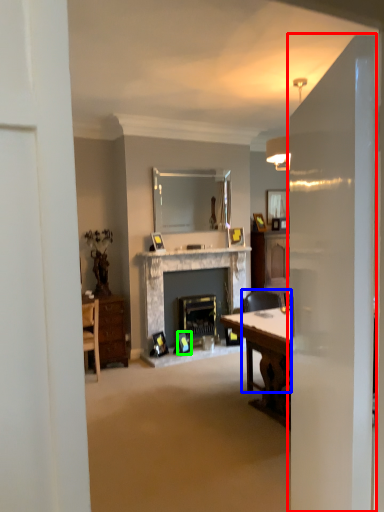
Question: Considering the real-world distances, which object is farthest from glass door (highlighted by a red box)? chair (highlighted by a blue box) or picture frame (highlighted by a green box)?

Choices:
 (A) chair
 (B) picture frame

Answer: (B)